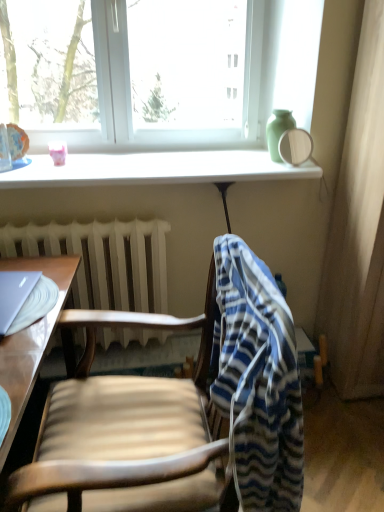
Where is `vacant space to the left of transparent glass mirror at upper right`? The image size is (384, 512). vacant space to the left of transparent glass mirror at upper right is located at coordinates (251, 168).